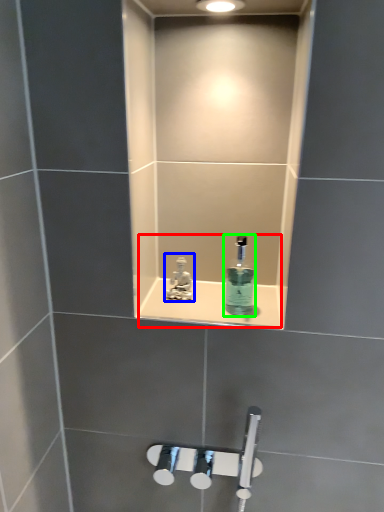
Question: Estimate the real-world distances between objects in this image. Which object is farther from sink (highlighted by a red box), tap (highlighted by a blue box) or mouthwash (highlighted by a green box)?

Choices:
 (A) tap
 (B) mouthwash

Answer: (A)